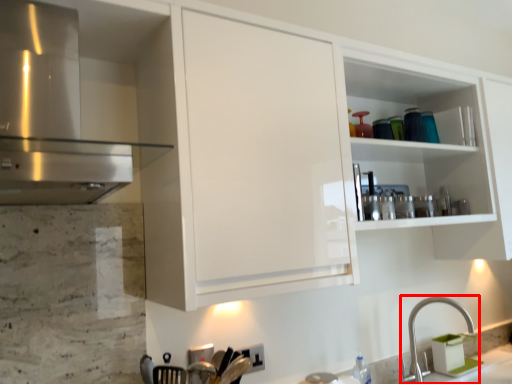
Question: From the image's perspective, what is the correct spatial relationship of tap (annotated by the red box) in relation to cabinetry?

Choices:
 (A) above
 (B) below

Answer: (B)